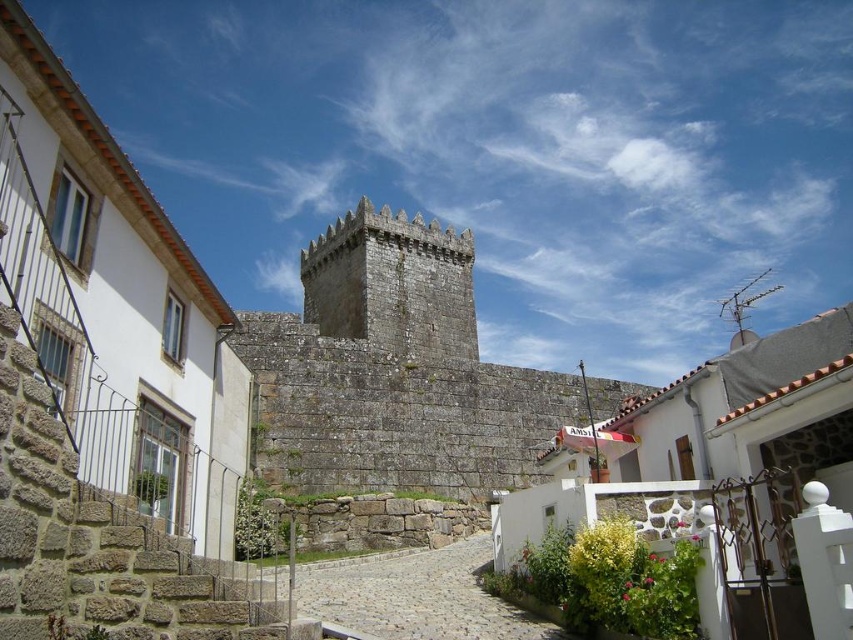
You are a tour guide explaining the layout of the village to visitors. You mention the rustic stone castle at center and the cobblestone alley at center. Which structure is wider?

The rustic stone castle at center is wider than the cobblestone alley at center.

You are standing at the entrance of the cobblestone alley at center and want to walk towards the rustic stone castle at center. Which direction should you turn to face the castle?

The rustic stone castle at center is positioned on the left side of cobblestone alley at center. Therefore, you should turn left to face the castle.